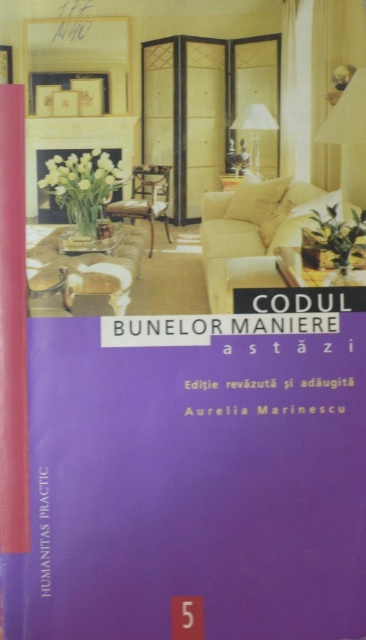
Consider the image. How distant is purple matte book at center from clear glass table at center?

purple matte book at center is 12.20 inches away from clear glass table at center.

Between purple matte book at center and clear glass table at center, which one has less height?

clear glass table at center is shorter.

Identify the location of purple matte book at center. The height and width of the screenshot is (640, 366). (192, 480).

Identify the location of purple matte book at center. This screenshot has width=366, height=640. (192, 480).

Does point (275, 604) come farther from viewer compared to point (296, 284)?

No, (275, 604) is in front of (296, 284).

Is purple matte book at center to the right of wooden table at center from the viewer's perspective?

No, purple matte book at center is not to the right of wooden table at center.

Is point (180, 358) in front of point (341, 269)?

Yes.

I want to click on purple matte book at center, so click(x=192, y=480).

Does purple matte book at center appear on the left side of matte white lampshade at upper center?

Yes, purple matte book at center is to the left of matte white lampshade at upper center.

Which is behind, point (28, 368) or point (240, 125)?

The point (240, 125) is behind.

Where is `purple matte book at center`? purple matte book at center is located at coordinates (192, 480).